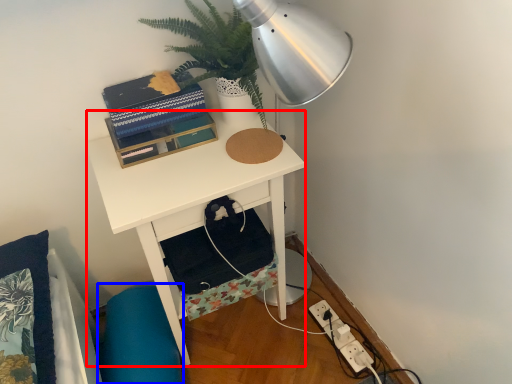
Question: Which of the following is the closest to the observer, desk (highlighted by a red box) or swivel chair (highlighted by a blue box)?

Choices:
 (A) desk
 (B) swivel chair

Answer: (A)